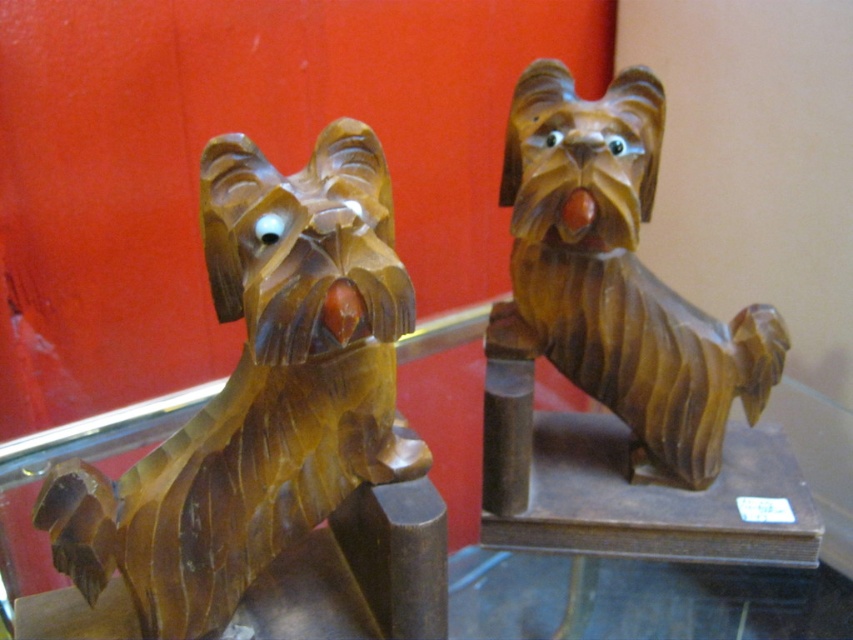
Question: Which point appears farthest from the camera in this image?

Choices:
 (A) (132, 509)
 (B) (585, 148)

Answer: (B)

Question: Can you confirm if wooden dog at left is bigger than wooden dog at right?

Choices:
 (A) no
 (B) yes

Answer: (B)

Question: Which object is closer to the camera taking this photo?

Choices:
 (A) wooden dog at right
 (B) wooden dog at left

Answer: (B)

Question: Can you confirm if wooden dog at left is positioned above wooden dog at right?

Choices:
 (A) yes
 (B) no

Answer: (B)

Question: Where is wooden dog at left located in relation to wooden dog at right in the image?

Choices:
 (A) below
 (B) above

Answer: (A)

Question: Which point is closer to the camera taking this photo?

Choices:
 (A) (630, 371)
 (B) (51, 472)

Answer: (B)